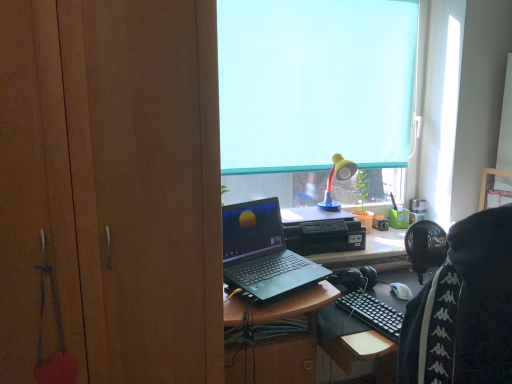
Question: In the image, is yellow matte lamp at upper center positioned in front of or behind wooden cabinet at left?

Choices:
 (A) front
 (B) behind

Answer: (B)

Question: Would you say yellow matte lamp at upper center is to the left or to the right of wooden cabinet at left in the picture?

Choices:
 (A) right
 (B) left

Answer: (A)

Question: Estimate the real-world distances between objects in this image. Which object is closer to the blue fabric at upper center?

Choices:
 (A) wooden cabinet at left
 (B) yellow matte lamp at upper center
 (C) black matte laptop at center

Answer: (B)

Question: Which of these objects is positioned closest to the wooden cabinet at left?

Choices:
 (A) black matte laptop at center
 (B) yellow matte lamp at upper center
 (C) blue fabric at upper center

Answer: (A)